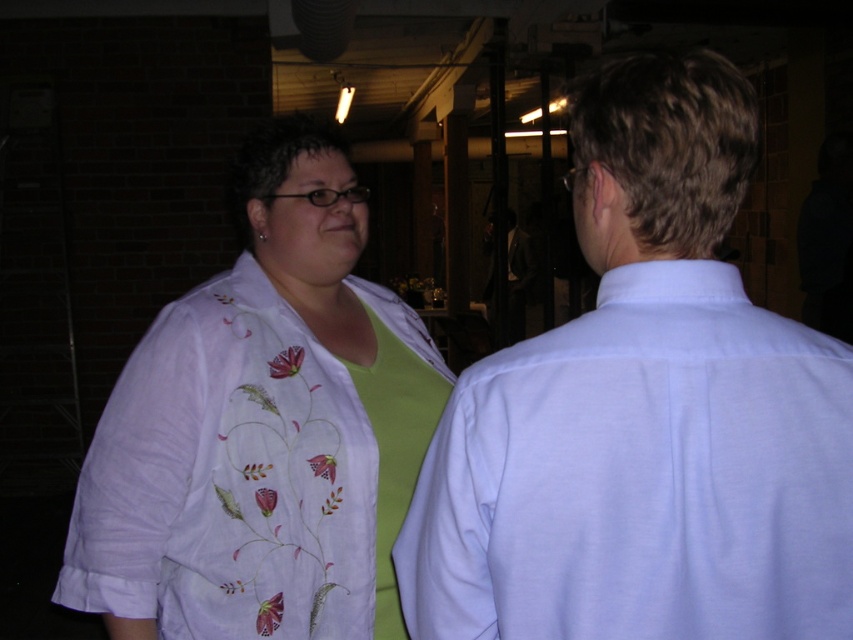
Question: Is white smooth shirt at center positioned at the back of white embroidered blouse at left?

Choices:
 (A) yes
 (B) no

Answer: (B)

Question: Is white smooth shirt at center in front of white embroidered blouse at left?

Choices:
 (A) yes
 (B) no

Answer: (A)

Question: Observing the image, what is the correct spatial positioning of white smooth shirt at center in reference to white embroidered blouse at left?

Choices:
 (A) right
 (B) left

Answer: (A)

Question: Which point is farther to the camera?

Choices:
 (A) (743, 308)
 (B) (393, 472)

Answer: (B)